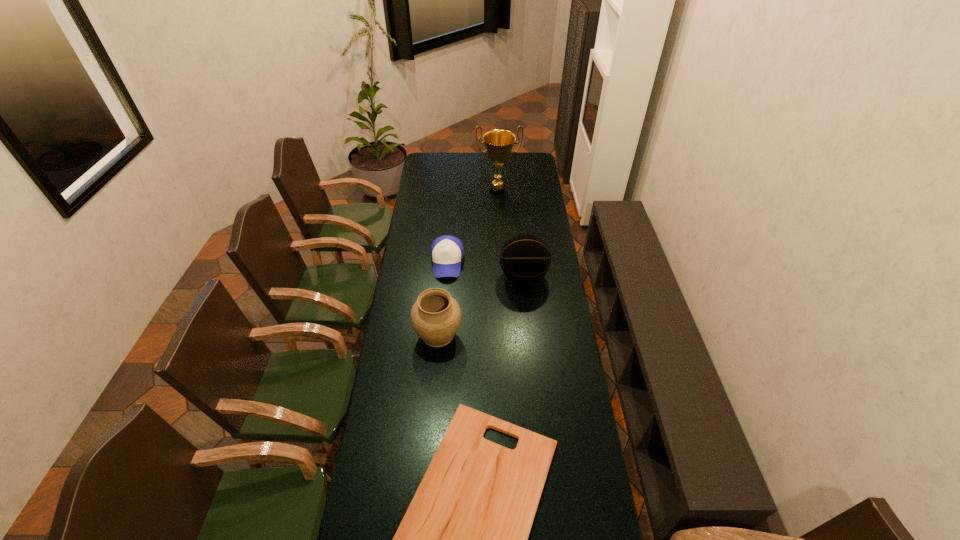
At what (x,y) coordinates should I click in order to perform the action: click on the farthest object. Please return your answer as a coordinate pair (x, y). This screenshot has height=540, width=960. Looking at the image, I should click on (498, 143).

Identify the location of award. (498, 143).

I want to click on basketball, so click(525, 258).

Image resolution: width=960 pixels, height=540 pixels. In order to click on urn in this screenshot , I will do `click(435, 317)`.

Where is `baseball cap`? The image size is (960, 540). baseball cap is located at coordinates (447, 252).

The image size is (960, 540). Find the location of `vacant space located on the front view with handles of the farthest object`. vacant space located on the front view with handles of the farthest object is located at coordinates (500, 234).

The image size is (960, 540). I want to click on free space located on the back of the basketball, so click(x=519, y=234).

Locate an element on the screen. This screenshot has height=540, width=960. vacant area situated on the right of the urn is located at coordinates (514, 334).

Identify the location of free spot located 0.060m on the front-facing side of the baseball cap. (444, 291).

Find the location of a particular element. This screenshot has height=540, width=960. urn located at the left edge is located at coordinates (435, 317).